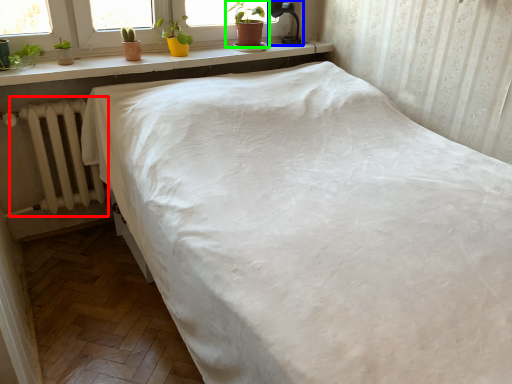
Question: Estimate the real-world distances between objects in this image. Which object is farther from radiator (highlighted by a red box), lamp (highlighted by a blue box) or houseplant (highlighted by a green box)?

Choices:
 (A) lamp
 (B) houseplant

Answer: (A)